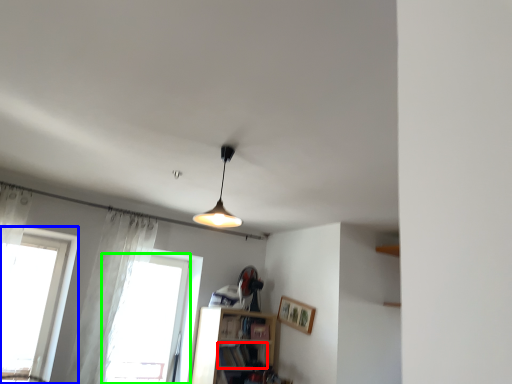
Question: Which is nearer to the book (highlighted by a red box)? window (highlighted by a blue box) or window (highlighted by a green box).

Choices:
 (A) window
 (B) window

Answer: (B)